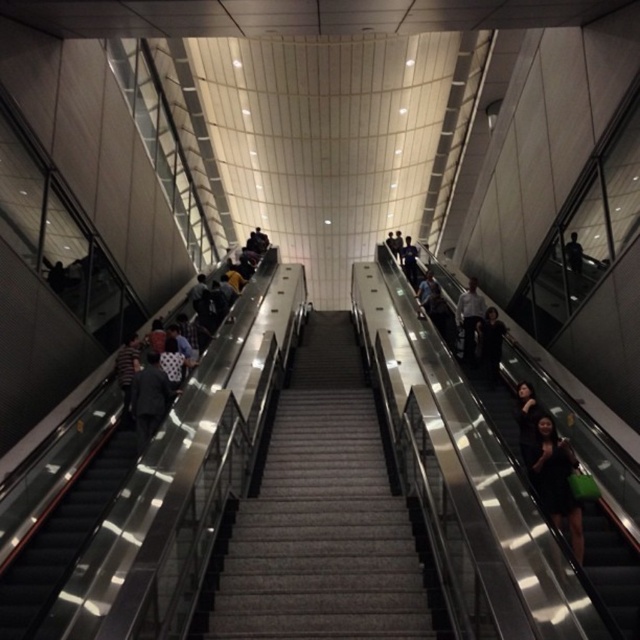
Can you confirm if black matte dress at right is thinner than dark gray suit at left?

Correct, black matte dress at right's width is less than dark gray suit at left's.

Does point (552, 451) come closer to viewer compared to point (147, 376)?

Yes, it is in front of point (147, 376).

At what (x,y) coordinates should I click in order to perform the action: click on black matte dress at right. Please return your answer as a coordinate pair (x, y). The width and height of the screenshot is (640, 640). Looking at the image, I should click on (556, 481).

Which is in front, point (128, 412) or point (577, 273)?

Point (128, 412) is in front.

Can you confirm if striped shirt at left is positioned above dark gray fabric jacket at upper right?

No.

Who is more forward, (131, 356) or (573, 236)?

Point (131, 356) is in front.

Find the location of `striped shirt at left`. striped shirt at left is located at coordinates (128, 369).

Is point (129, 422) positioned before point (145, 445)?

That is False.

Does dark gray fabric jacket at left come behind dark gray suit at left?

No, it is not.

The width and height of the screenshot is (640, 640). I want to click on dark gray fabric jacket at left, so (148, 403).